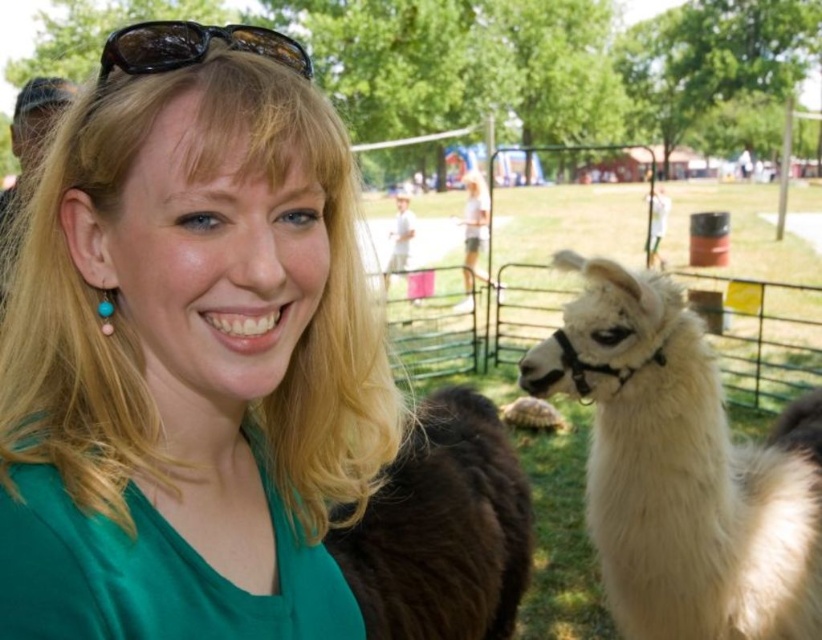
Question: Is green silk shirt at upper left below white fluffy alpaca at right?

Choices:
 (A) no
 (B) yes

Answer: (A)

Question: Is green silk shirt at upper left to the right of black shiny sunglasses at upper center from the viewer's perspective?

Choices:
 (A) yes
 (B) no

Answer: (B)

Question: Which of the following is the closest to the observer?

Choices:
 (A) brown fuzzy alpaca at right
 (B) black shiny sunglasses at upper center
 (C) white fluffy alpaca at right
 (D) green silk shirt at upper left

Answer: (D)

Question: Which of the following is the closest to the observer?

Choices:
 (A) green silk shirt at upper left
 (B) brown fuzzy alpaca at right
 (C) black shiny sunglasses at upper center
 (D) white fluffy alpaca at right

Answer: (A)

Question: Can you confirm if white fluffy alpaca at right is positioned to the right of brown fuzzy alpaca at right?

Choices:
 (A) no
 (B) yes

Answer: (B)

Question: Which object is the closest to the brown fuzzy alpaca at right?

Choices:
 (A) black shiny sunglasses at upper center
 (B) white fluffy alpaca at right
 (C) green silk shirt at upper left

Answer: (B)